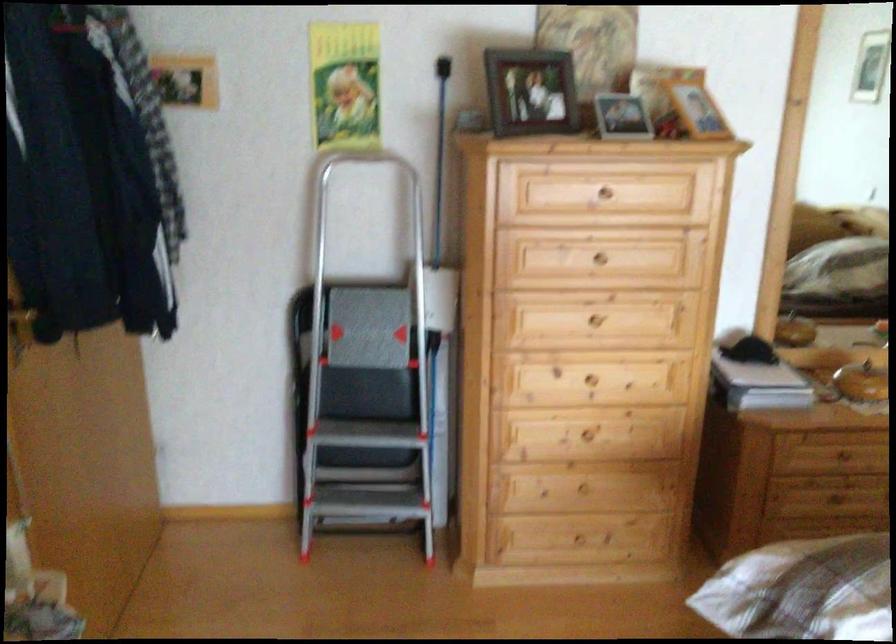
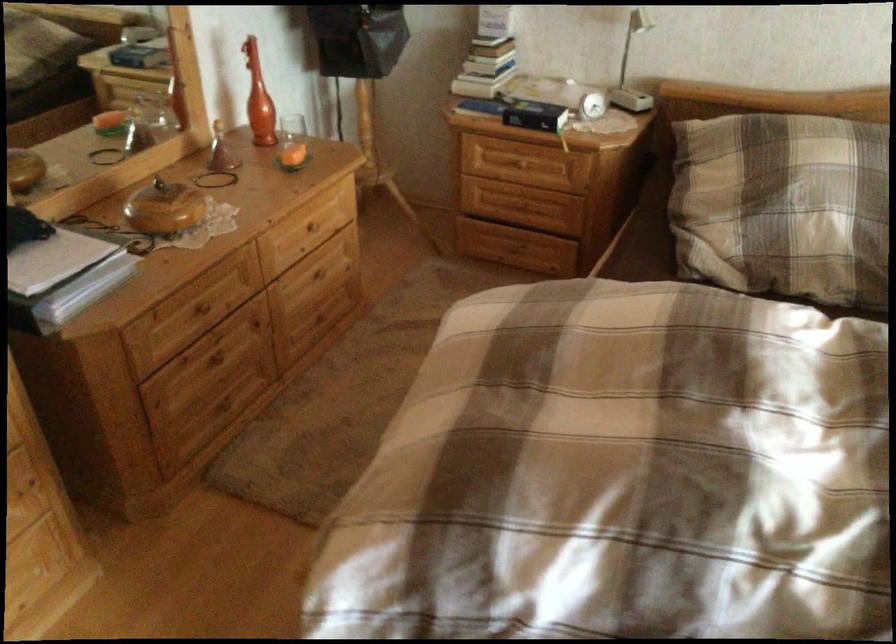
The images are taken continuously from a first-person perspective. In which direction is your viewpoint rotating?

The rotation direction of the camera is right-down.